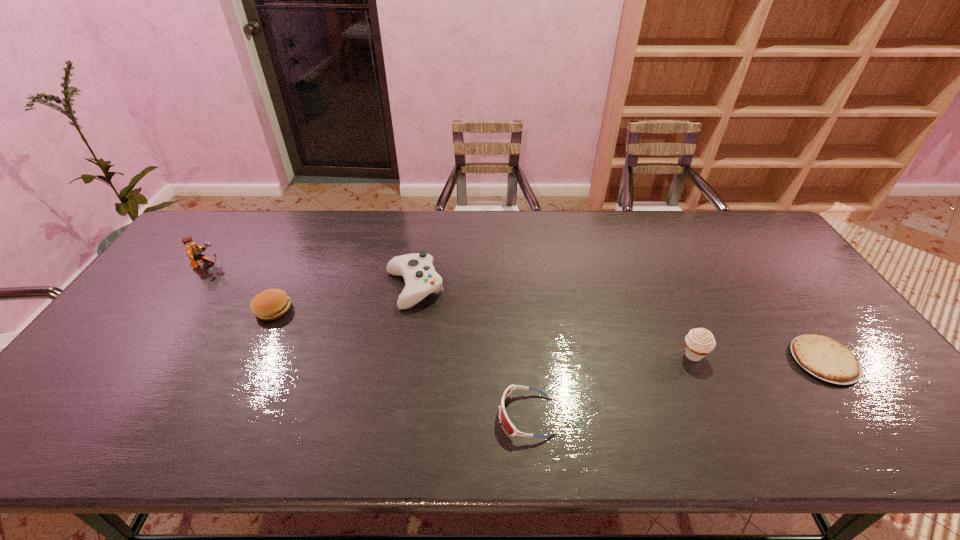
At what (x,y) coordinates should I click in order to perform the action: click on free region located on the back of the muffin. Please return your answer as a coordinate pair (x, y). Image resolution: width=960 pixels, height=540 pixels. Looking at the image, I should click on (674, 312).

At what (x,y) coordinates should I click in order to perform the action: click on free space located 0.320m on the front of the control. Please return your answer as a coordinate pair (x, y). Looking at the image, I should click on (394, 414).

Where is `free space located on the back of the fifth object from right to left`? The height and width of the screenshot is (540, 960). free space located on the back of the fifth object from right to left is located at coordinates (312, 229).

At what (x,y) coordinates should I click in order to perform the action: click on free space located on the front-facing side of the nearest object. Please return your answer as a coordinate pair (x, y). The image size is (960, 540). Looking at the image, I should click on coord(411,416).

Where is `free space located 0.110m on the front-facing side of the nearest object`? free space located 0.110m on the front-facing side of the nearest object is located at coordinates (450, 416).

You are a GUI agent. You are given a task and a screenshot of the screen. Output one action in this format:
    pyautogui.click(x=<x>, y=<y>)
    Task: Click on the free region located 0.200m on the front-facing side of the nearest object
    The width and height of the screenshot is (960, 540).
    Given the screenshot: What is the action you would take?
    pyautogui.click(x=411, y=416)

I want to click on vacant space located on the front of the rightmost object, so click(x=864, y=416).

This screenshot has width=960, height=540. Find the location of `object situated at the near edge`. object situated at the near edge is located at coordinates (505, 421).

Find the location of a particular element. object that is at the left edge is located at coordinates (x=193, y=250).

The height and width of the screenshot is (540, 960). Find the location of `object that is at the right edge`. object that is at the right edge is located at coordinates (824, 357).